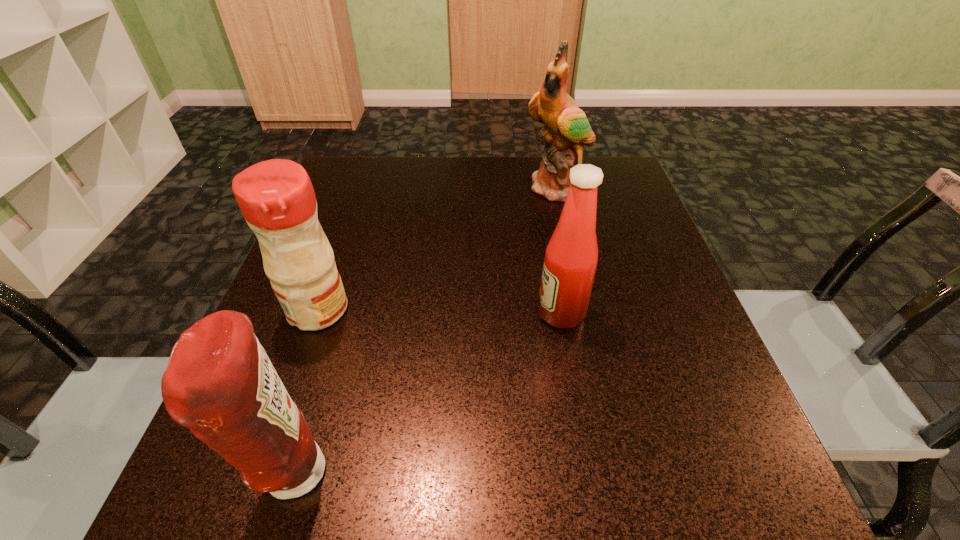
This screenshot has height=540, width=960. What are the coordinates of `object located in the near edge section of the desktop` in the screenshot? It's located at (220, 383).

The image size is (960, 540). Find the location of `object at the right edge`. object at the right edge is located at coordinates (567, 128).

Identify the location of object that is at the near left corner. (220, 383).

I want to click on object that is at the far right corner, so click(567, 128).

In the image, there is a desktop. Where is `blank space at the far edge`? Image resolution: width=960 pixels, height=540 pixels. blank space at the far edge is located at coordinates 509,156.

This screenshot has width=960, height=540. I want to click on free space at the left edge, so click(x=315, y=420).

Find the location of a particular element. This screenshot has height=540, width=960. free space at the right edge of the desktop is located at coordinates (675, 429).

Identify the location of vacant space at the near left corner. This screenshot has height=540, width=960. (243, 504).

Locate an element on the screen. The height and width of the screenshot is (540, 960). vacant space at the far right corner of the desktop is located at coordinates pyautogui.click(x=604, y=198).

Locate an element on the screen. free space between the parrot and the nearest object is located at coordinates (426, 331).